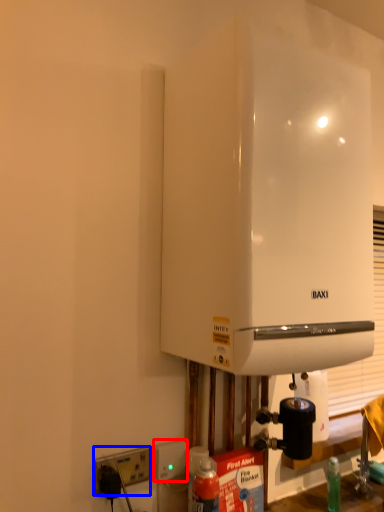
Question: Which point is further to the camera, electric outlet (highlighted by a red box) or electric outlet (highlighted by a blue box)?

Choices:
 (A) electric outlet
 (B) electric outlet

Answer: (A)